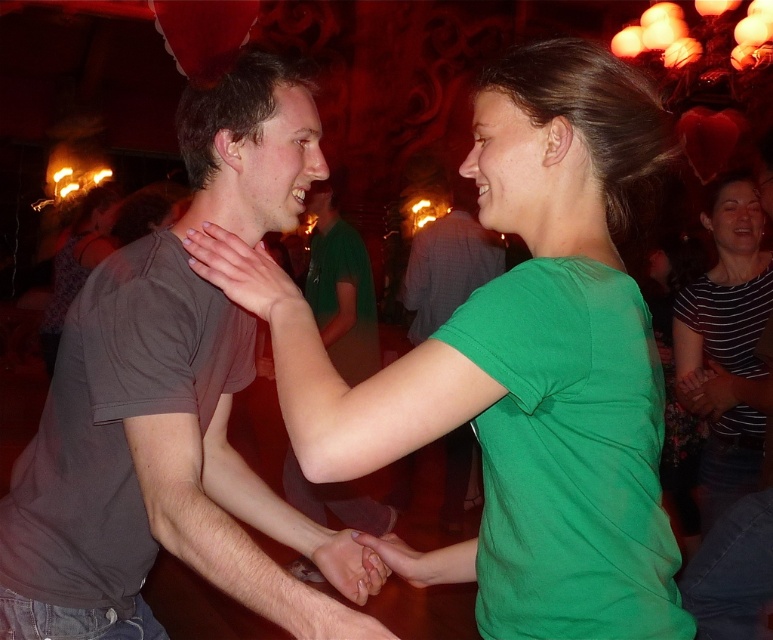
Question: Considering the real-world distances, which object is farthest from the matte green hand at center?

Choices:
 (A) gray matte t-shirt at left
 (B) matte gray shirt at center
 (C) smooth skin hand at center
 (D) green matte shirt at upper right

Answer: (B)

Question: Which of the following is the farthest from the observer?

Choices:
 (A) (434, 566)
 (B) (169, 380)
 (C) (550, 545)
 (D) (336, 541)

Answer: (D)

Question: Is matte gray shirt at center smaller than green matte hand at center?

Choices:
 (A) yes
 (B) no

Answer: (B)

Question: Estimate the real-world distances between objects in this image. Which object is closer to the matte gray shirt at center?

Choices:
 (A) green matte shirt at upper right
 (B) gray matte t-shirt at left
 (C) green matte hand at center

Answer: (A)

Question: Can you confirm if green matte shirt at center is wider than gray matte t-shirt at left?

Choices:
 (A) yes
 (B) no

Answer: (B)

Question: Can you confirm if gray matte t-shirt at left is bigger than matte gray shirt at center?

Choices:
 (A) no
 (B) yes

Answer: (B)